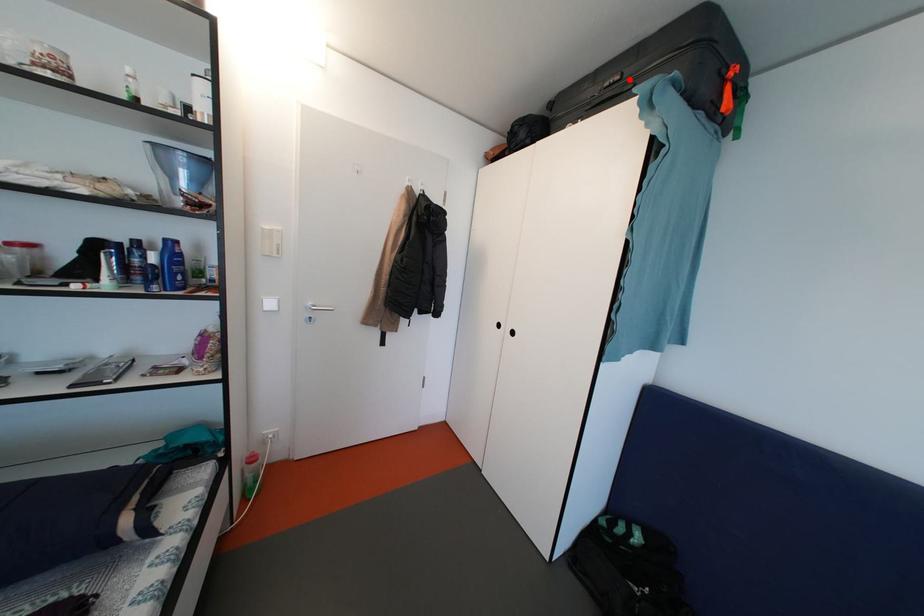
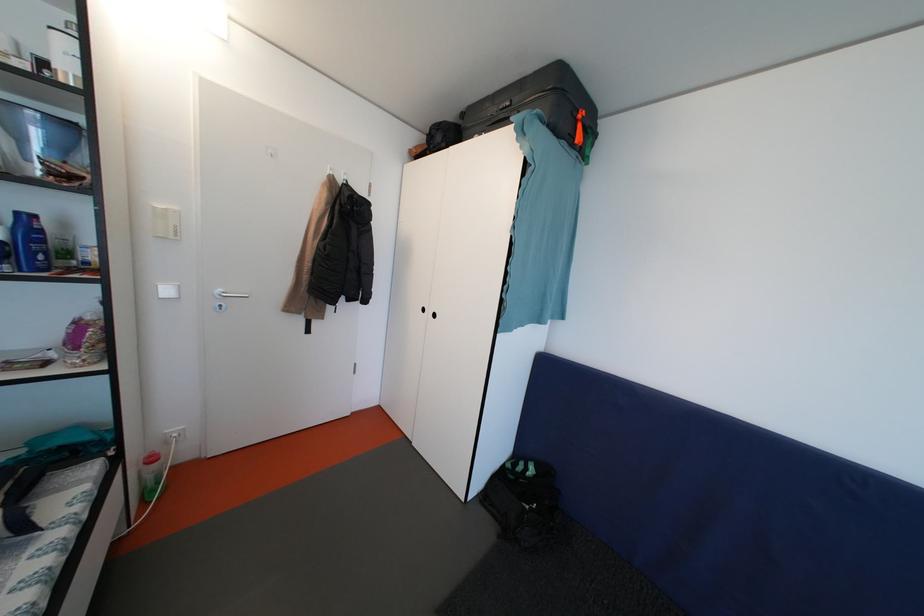
Where in the second image is the point corresponding to the highlighted location from the first image?

(518, 107)